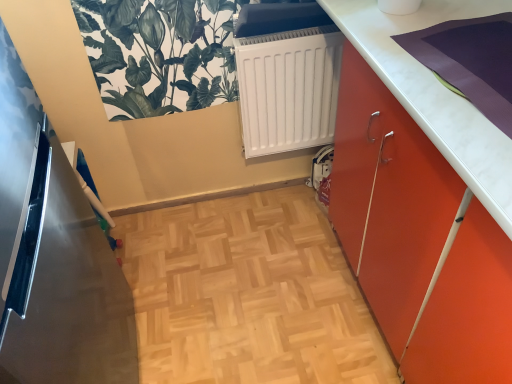
Question: Considering the relative positions of white matte radiator at center and metallic refrigerator at left in the image provided, is white matte radiator at center to the right of metallic refrigerator at left from the viewer's perspective?

Choices:
 (A) yes
 (B) no

Answer: (A)

Question: Does white matte radiator at center have a greater width compared to metallic refrigerator at left?

Choices:
 (A) yes
 (B) no

Answer: (B)

Question: Considering the relative sizes of white matte radiator at center and metallic refrigerator at left in the image provided, is white matte radiator at center smaller than metallic refrigerator at left?

Choices:
 (A) no
 (B) yes

Answer: (B)

Question: From a real-world perspective, does white matte radiator at center stand above metallic refrigerator at left?

Choices:
 (A) yes
 (B) no

Answer: (B)

Question: Is white matte radiator at center with metallic refrigerator at left?

Choices:
 (A) no
 (B) yes

Answer: (A)

Question: From a real-world perspective, is white matte radiator at center beneath metallic refrigerator at left?

Choices:
 (A) no
 (B) yes

Answer: (B)

Question: From the image's perspective, does green leafy plant at upper left appear higher than white matte radiator at center?

Choices:
 (A) yes
 (B) no

Answer: (A)

Question: Does green leafy plant at upper left have a larger size compared to white matte radiator at center?

Choices:
 (A) yes
 (B) no

Answer: (B)

Question: Is green leafy plant at upper left turned away from white matte radiator at center?

Choices:
 (A) yes
 (B) no

Answer: (B)

Question: Is green leafy plant at upper left smaller than white matte radiator at center?

Choices:
 (A) yes
 (B) no

Answer: (A)

Question: Is green leafy plant at upper left with white matte radiator at center?

Choices:
 (A) no
 (B) yes

Answer: (A)

Question: Is green leafy plant at upper left located outside white matte radiator at center?

Choices:
 (A) no
 (B) yes

Answer: (B)

Question: Considering the relative positions of white matte radiator at center and green leafy plant at upper left in the image provided, is white matte radiator at center in front of green leafy plant at upper left?

Choices:
 (A) yes
 (B) no

Answer: (B)